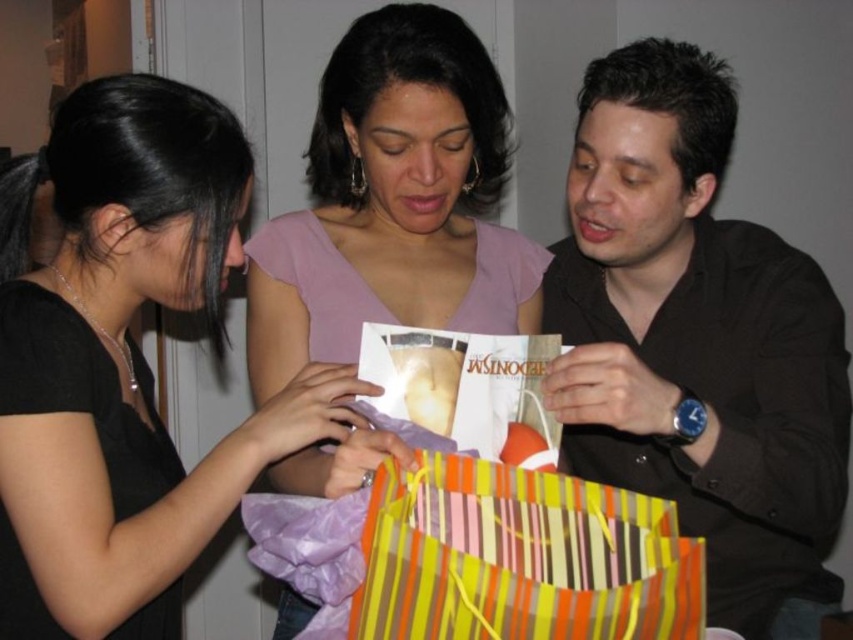
What is the position of the black matte shirt at right?

The black matte shirt at right is located at point 0.536 on the x axis and 0.818 on the y axis.

You are a photographer standing in front of the scene. You need to take a photo that includes both the black matte shirt at right and the pink fabric shirt at center. The camera has a minimum focus distance of 12 inches. Will you be able to capture both subjects in focus without moving the camera?

The black matte shirt at right and pink fabric shirt at center are 11.68 inches apart from each other, which is less than the camera minimum focus distance of 12 inches. Therefore, the camera cannot focus on both subjects simultaneously without moving the camera.